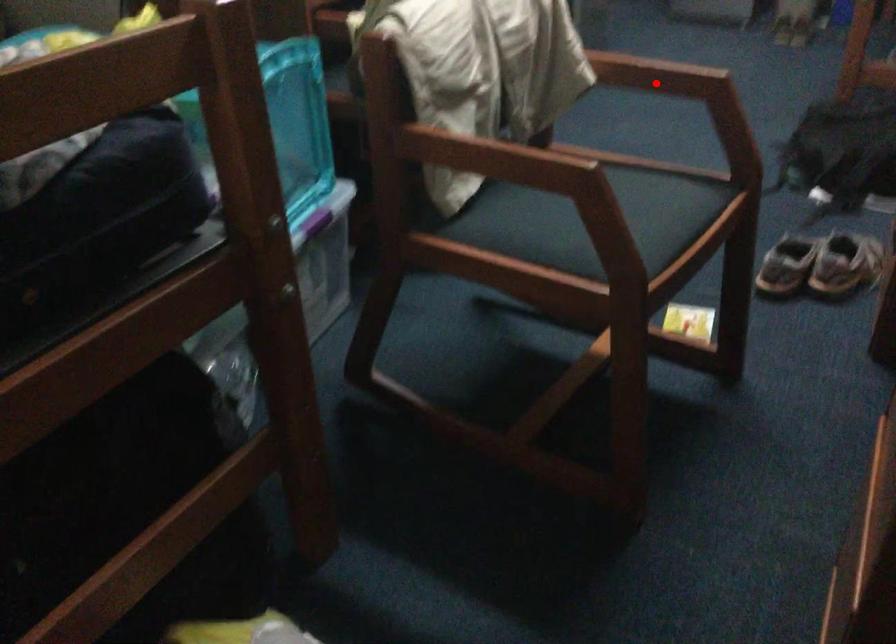
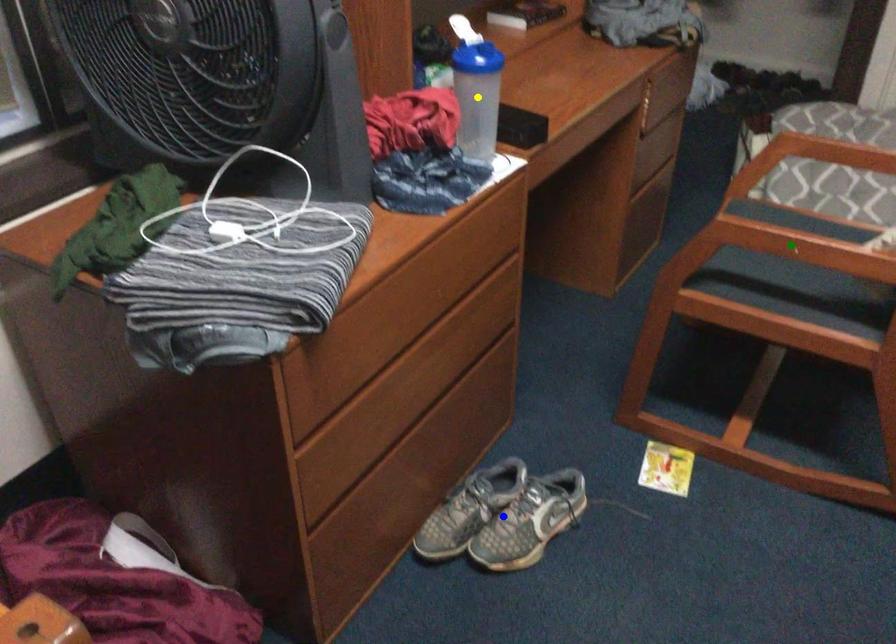
Question: I am providing you with two images of the same scene from different viewpoints. A red point is marked on the first image. You are given multiple points on the second image. Which point in image 2 is actually the same real-world point as the red point in image 1?

Choices:
 (A) green point
 (B) yellow point
 (C) blue point

Answer: (A)